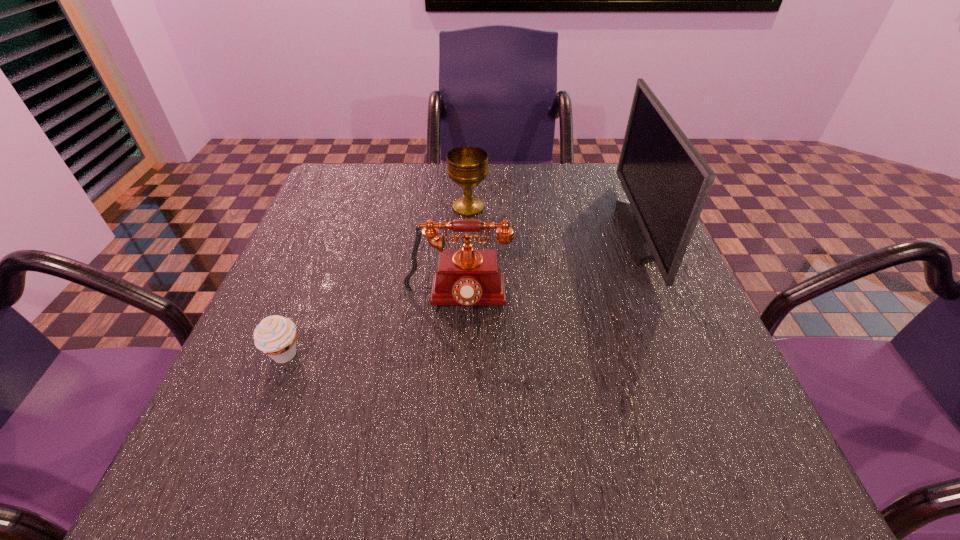
Select which object appears as the second closest to the chalice. Please provide its 2D coordinates. Your answer should be formatted as a tuple, i.e. [(x, y)], where the tuple contains the x and y coordinates of a point satisfying the conditions above.

[(666, 180)]

The width and height of the screenshot is (960, 540). Identify the location of free point that satisfies the following two spatial constraints: 1. on the screen side of the rightmost object; 2. on the dial of the telephone. (675, 299).

The image size is (960, 540). In order to click on free spot that satisfies the following two spatial constraints: 1. on the screen side of the tallest object; 2. on the dial of the telephone in this screenshot , I will do `click(675, 299)`.

This screenshot has width=960, height=540. In order to click on vacant position in the image that satisfies the following two spatial constraints: 1. on the back side of the leftmost object; 2. on the left side of the second shortest object in this screenshot , I will do [x=344, y=207].

Locate an element on the screen. vacant space that satisfies the following two spatial constraints: 1. on the screen side of the monitor; 2. on the dial of the third shortest object is located at coordinates (675, 299).

Where is `blank space that satisfies the following two spatial constraints: 1. on the screen side of the tallest object; 2. on the dial of the third shortest object`? The height and width of the screenshot is (540, 960). blank space that satisfies the following two spatial constraints: 1. on the screen side of the tallest object; 2. on the dial of the third shortest object is located at coordinates (675, 299).